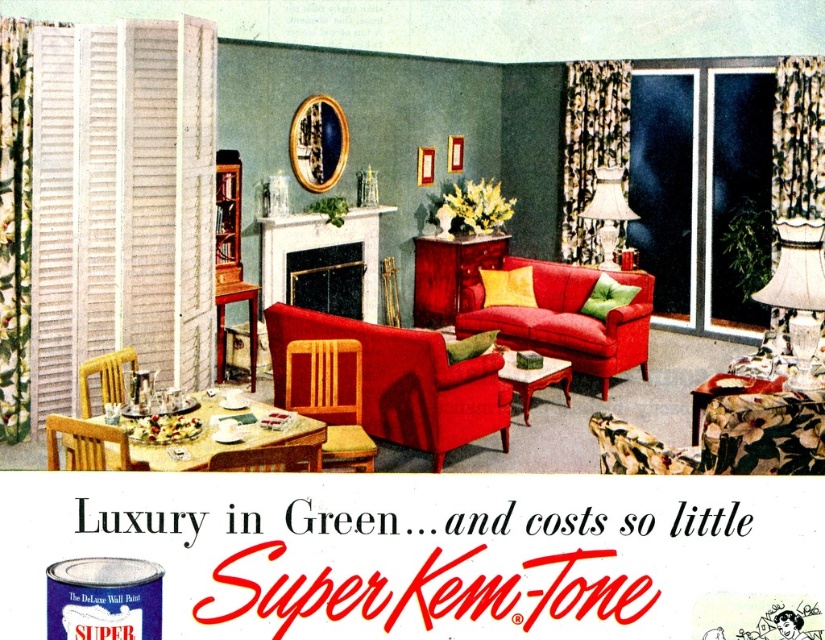
You are standing in the vintage living room and want to place a decorative plant on the floor near the white marble fireplace at center. Since the wooden chair at lower left is in the way, can you move the plant to a spot directly in front of the fireplace without it being blocked by the chair?

The white marble fireplace at center is located above the wooden chair at lower left, meaning the chair is positioned below the fireplace. Therefore, placing the plant directly in front of the fireplace would not be blocked by the chair since the chair is beneath it, not in front.